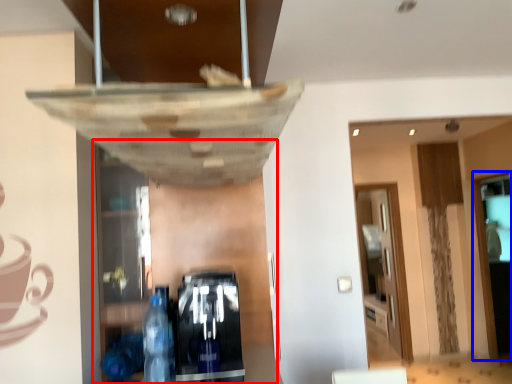
Question: Which object appears farthest to the camera in this image, shelf (highlighted by a red box) or glass door (highlighted by a blue box)?

Choices:
 (A) shelf
 (B) glass door

Answer: (B)